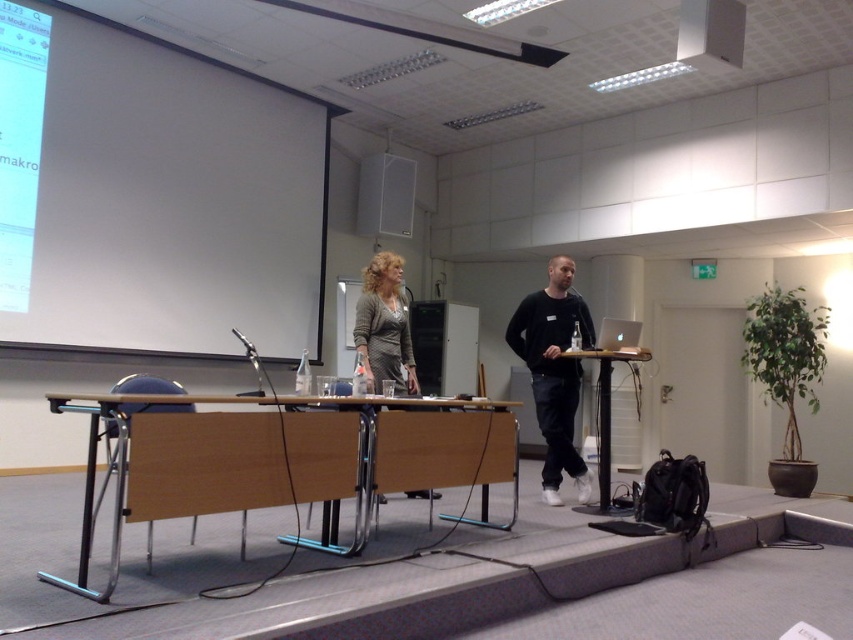
Question: Which point appears farthest from the camera in this image?

Choices:
 (A) (410, 173)
 (B) (389, 365)
 (C) (350, 492)
 (D) (106, 204)

Answer: (A)

Question: Can you confirm if white matte projection screen at upper left is positioned below black plastic table at center?

Choices:
 (A) no
 (B) yes

Answer: (A)

Question: Which point appears closest to the camera in this image?

Choices:
 (A) (368, 221)
 (B) (605, 417)

Answer: (B)

Question: Observing the image, what is the correct spatial positioning of metallic silver speaker at upper center in reference to black plastic table at center?

Choices:
 (A) right
 (B) left

Answer: (B)

Question: Which point is closer to the camera?

Choices:
 (A) matte gray sweater at center
 (B) white matte projection screen at upper left
 (C) black plastic table at center

Answer: (A)

Question: Is black matte shirt at center to the left of matte gray sweater at center from the viewer's perspective?

Choices:
 (A) no
 (B) yes

Answer: (A)